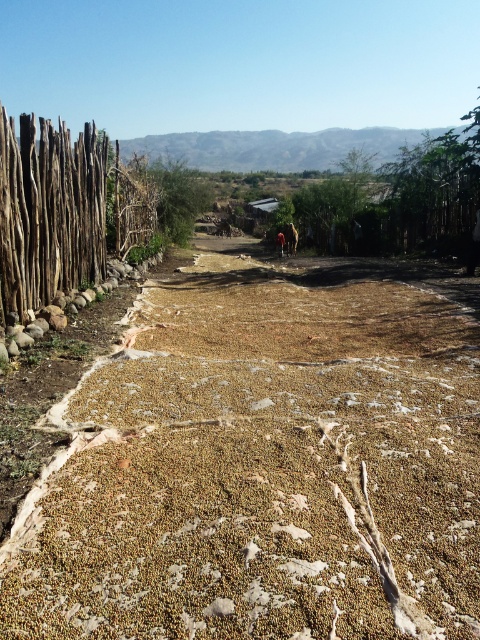
Is brown rough dirt field at center below brown wooden fence at left?

Correct, brown rough dirt field at center is located below brown wooden fence at left.

Is point (469, 621) farther from camera compared to point (97, 224)?

No, it is not.

Image resolution: width=480 pixels, height=640 pixels. I want to click on brown rough dirt field at center, so click(x=263, y=460).

Does brown wooden fence at left appear on the left side of green leafy tree at center?

No, brown wooden fence at left is not to the left of green leafy tree at center.

Measure the distance between brown wooden fence at left and green leafy tree at center.

brown wooden fence at left and green leafy tree at center are 7.92 meters apart from each other.

Image resolution: width=480 pixels, height=640 pixels. What do you see at coordinates (49, 211) in the screenshot?
I see `brown wooden fence at left` at bounding box center [49, 211].

This screenshot has width=480, height=640. Identify the location of brown wooden fence at left. (49, 211).

Between brown rough dirt field at center and green leafy tree at center, which one has more height?

Standing taller between the two is green leafy tree at center.

Does point (115, 412) lie in front of point (184, 240)?

Yes, point (115, 412) is in front of point (184, 240).

Who is more forward, (x=136, y=410) or (x=147, y=164)?

Positioned in front is point (x=136, y=410).

Locate an element on the screen. The height and width of the screenshot is (640, 480). brown rough dirt field at center is located at coordinates click(263, 460).